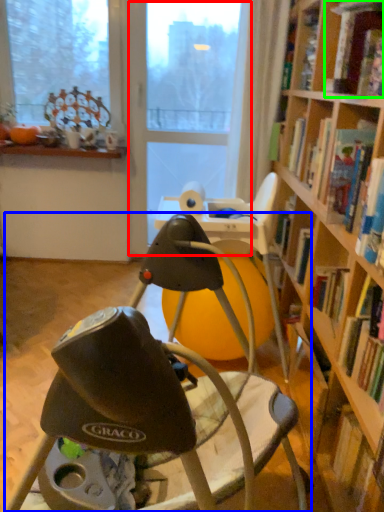
Question: Which object is the farthest from screen door (highlighted by a red box)? Choose among these: chair (highlighted by a blue box) or book (highlighted by a green box).

Choices:
 (A) chair
 (B) book

Answer: (A)